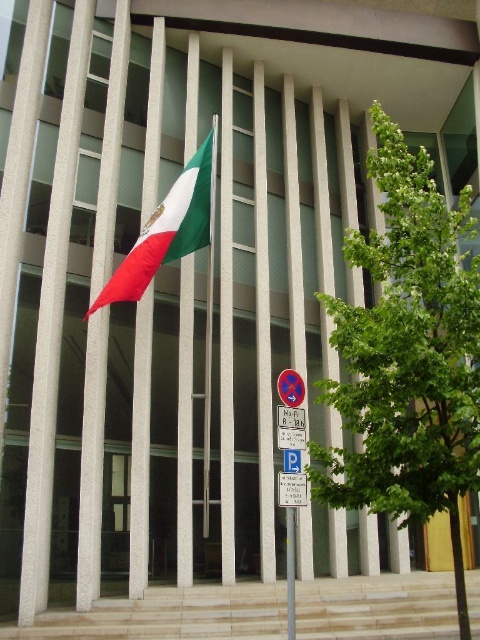
Question: Estimate the real-world distances between objects in this image. Which object is farther from the white plastic parking sign at center?

Choices:
 (A) green matte flag at center
 (B) green fabric flag at upper left
 (C) green leafy tree at right

Answer: (A)

Question: Which is nearer to the metallic flag pole at center?

Choices:
 (A) green matte flag at center
 (B) white plastic parking sign at center
 (C) green fabric flag at upper left
 (D) green leafy tree at right

Answer: (A)

Question: Which of these objects is positioned closest to the metallic flag pole at center?

Choices:
 (A) white plastic parking sign at center
 (B) green fabric flag at upper left

Answer: (A)

Question: Does green leafy tree at right appear over green fabric flag at upper left?

Choices:
 (A) no
 (B) yes

Answer: (B)

Question: Does green leafy tree at right come in front of green fabric flag at upper left?

Choices:
 (A) yes
 (B) no

Answer: (A)

Question: Where is metallic flag pole at center located in relation to green fabric flag at upper left in the image?

Choices:
 (A) left
 (B) right

Answer: (A)